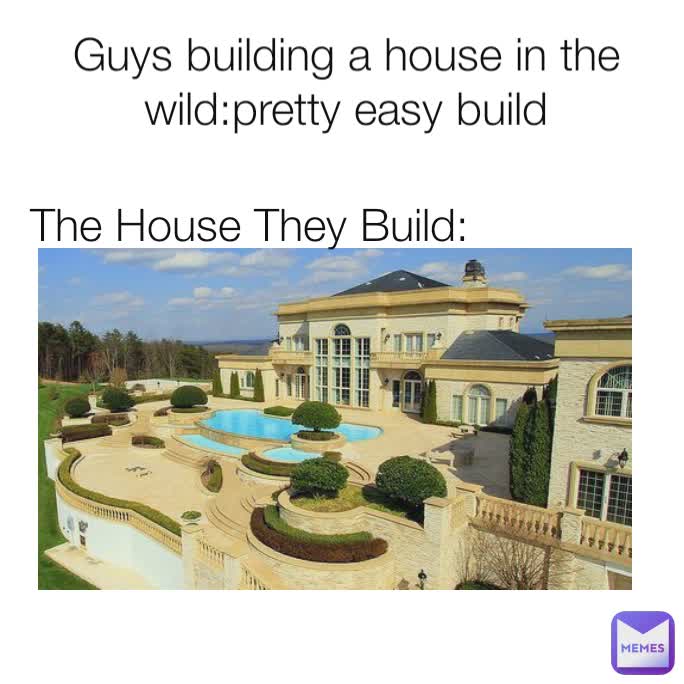
Locate an element on the screen. This screenshot has height=684, width=684. jacuzzi area is located at coordinates (284, 455).